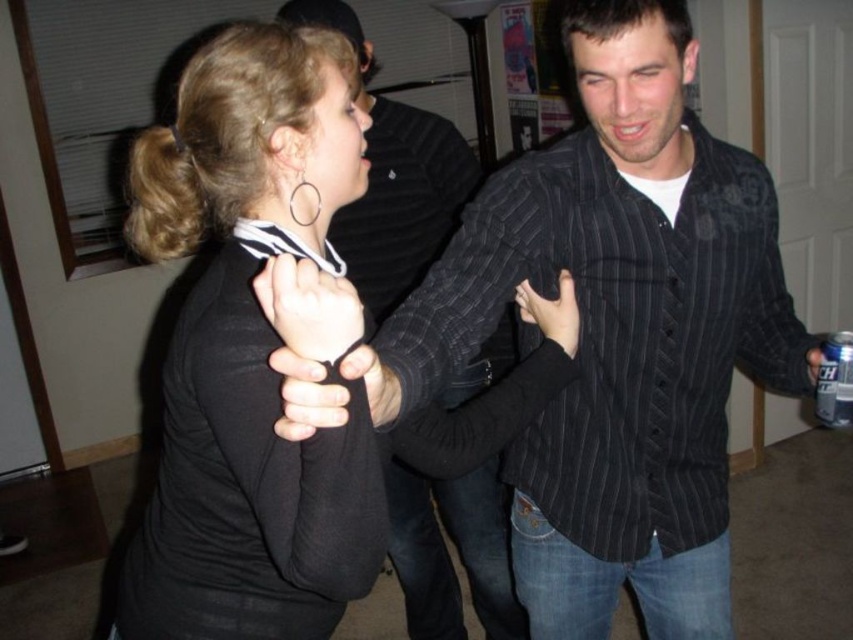
You are a photographer standing at the center of the room. You want to take a photo of both the black matte shirt at upper left and the black pinstripe shirt at center. Since your camera has a limited focus range of 3 feet, will both subjects be in focus?

The black matte shirt at upper left is 3.35 feet away from the black pinstripe shirt at center. Since the distance between them is greater than the camera focus range of 3 feet, the photographer cannot have both in focus at the same time.

You are a photographer trying to capture a closeup shot of the black pinstripe shirt at center and the matte black glove at center. Which object should you focus on first to ensure it appears sharp in the photo?

The black pinstripe shirt at center is further to the viewer than the matte black glove at center, so you should focus on the black pinstripe shirt at center first to ensure it appears sharp.

You are trying to decide which shirt to wear for a casual event. Both the black matte shirt at upper left and the black pinstripe shirt at center are options. Which one has a wider silhouette?

The black matte shirt at upper left is wider than the black pinstripe shirt at center, so it has a wider silhouette.